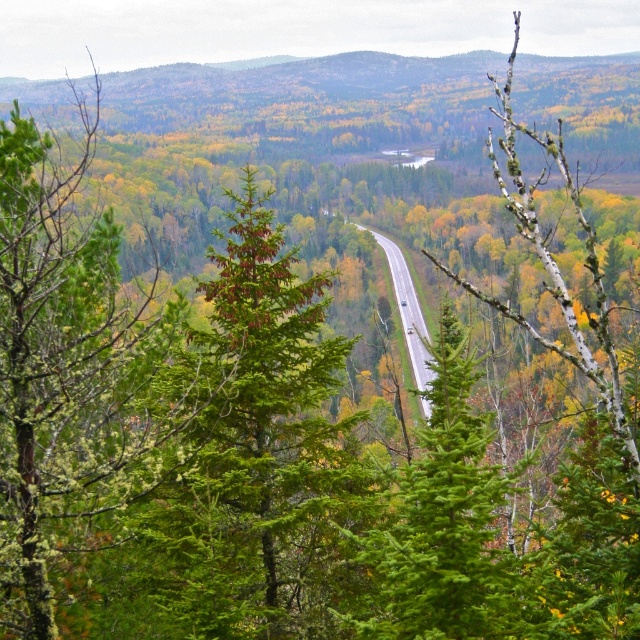
You are standing at the starting point of the road in the forest scene. There are two points marked on the road ahead. The first point is at coordinates point (442,364) and the second is at point (397,300). Which point is closer to you as you face the road?

Point (442,364) is closer to the viewer than point (397,300).

You are driving along the asphalt road at center and want to know if you can see the green leafy tree at center in your rearview mirror while moving forward. Can you?

The green leafy tree at center is smaller than the asphalt road at center, so it is possible that the tree may be obscured by the road itself as you drive forward. Therefore, you might not see the green leafy tree at center in your rearview mirror while moving forward.